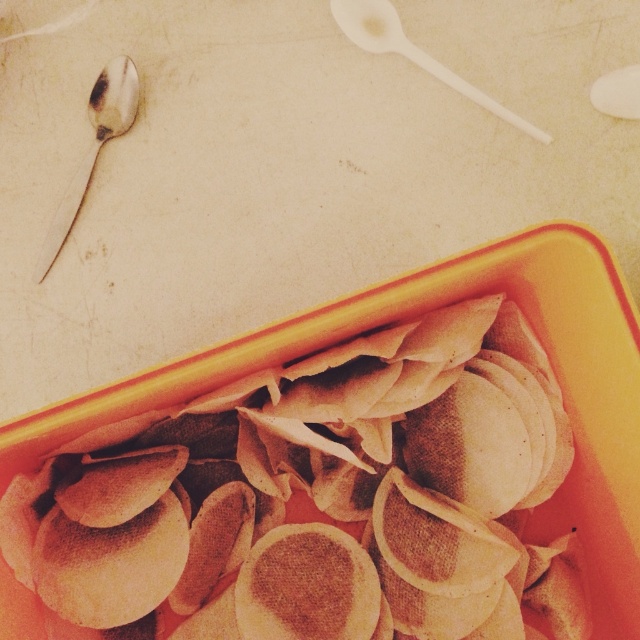
Question: Which of these objects is positioned farthest from the white plastic spoon at upper center?

Choices:
 (A) brown matte dumplings at center
 (B) shiny silver spoon at upper left

Answer: (A)

Question: Which object is farther from the camera taking this photo?

Choices:
 (A) shiny silver spoon at upper left
 (B) white plastic spoon at upper center
 (C) brown matte dumplings at center

Answer: (B)

Question: Does brown matte dumplings at center come in front of white plastic spoon at upper center?

Choices:
 (A) no
 (B) yes

Answer: (B)

Question: Does brown matte dumplings at center appear under white plastic spoon at upper center?

Choices:
 (A) yes
 (B) no

Answer: (A)

Question: Which point is farther from the camera taking this photo?

Choices:
 (A) (58, 209)
 (B) (417, 536)

Answer: (A)

Question: Can you confirm if brown matte dumplings at center is positioned to the right of white plastic spoon at upper center?

Choices:
 (A) no
 (B) yes

Answer: (A)